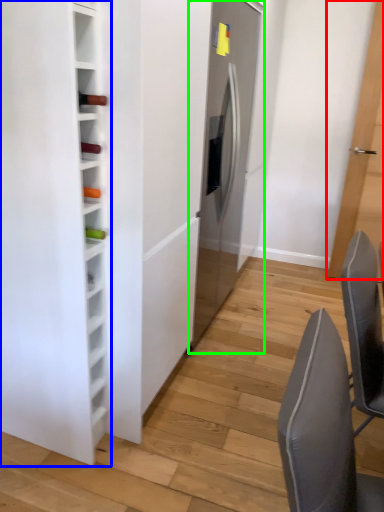
Question: Estimate the real-world distances between objects in this image. Which object is closer to door (highlighted by a red box), furniture (highlighted by a blue box) or fridge (highlighted by a green box)?

Choices:
 (A) furniture
 (B) fridge

Answer: (B)